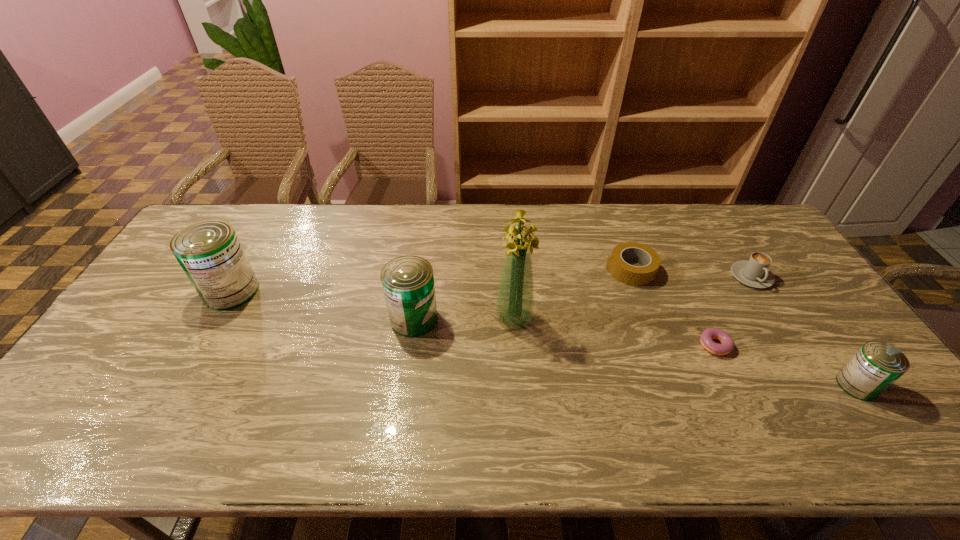
Image resolution: width=960 pixels, height=540 pixels. Find the location of `the leftmost object`. the leftmost object is located at coordinates pyautogui.click(x=209, y=252).

You are a GUI agent. You are given a task and a screenshot of the screen. Output one action in this format:
    pyautogui.click(x=<x>, y=<y>)
    Task: Click on the second tallest can
    Image resolution: width=960 pixels, height=540 pixels.
    Given the screenshot: What is the action you would take?
    pyautogui.click(x=408, y=282)

Where is `the third tallest object`? The image size is (960, 540). the third tallest object is located at coordinates (408, 282).

The height and width of the screenshot is (540, 960). What are the coordinates of `the shortest can` in the screenshot? It's located at (876, 365).

Identify the location of the nearest object. The width and height of the screenshot is (960, 540). (876, 365).

Locate an element on the screen. The height and width of the screenshot is (540, 960). the third shortest object is located at coordinates (755, 273).

The width and height of the screenshot is (960, 540). I want to click on the fifth object from right to left, so click(x=515, y=300).

Identify the location of bouquet. This screenshot has height=540, width=960. (515, 300).

Locate an element on the screen. This screenshot has height=540, width=960. duct tape is located at coordinates (628, 274).

Identify the location of the fourth object from right to left. This screenshot has width=960, height=540. (628, 274).